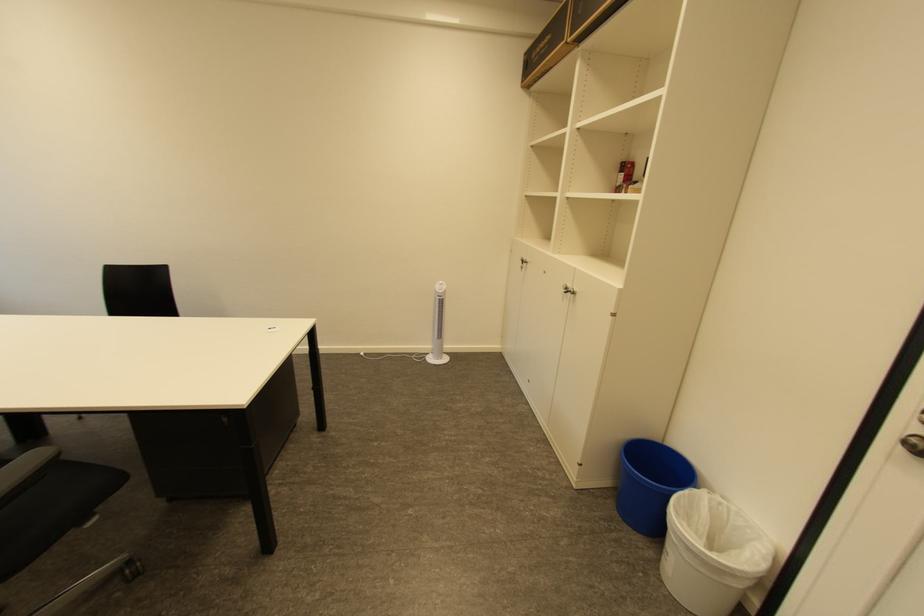
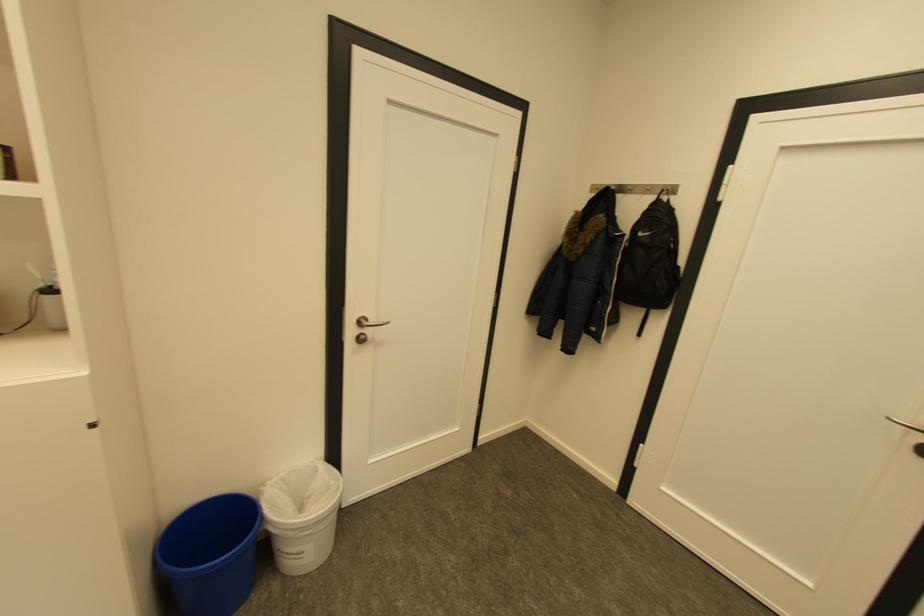
Where in the second image is the point corresponding to pixel 736 509 from the first image?

(289, 477)